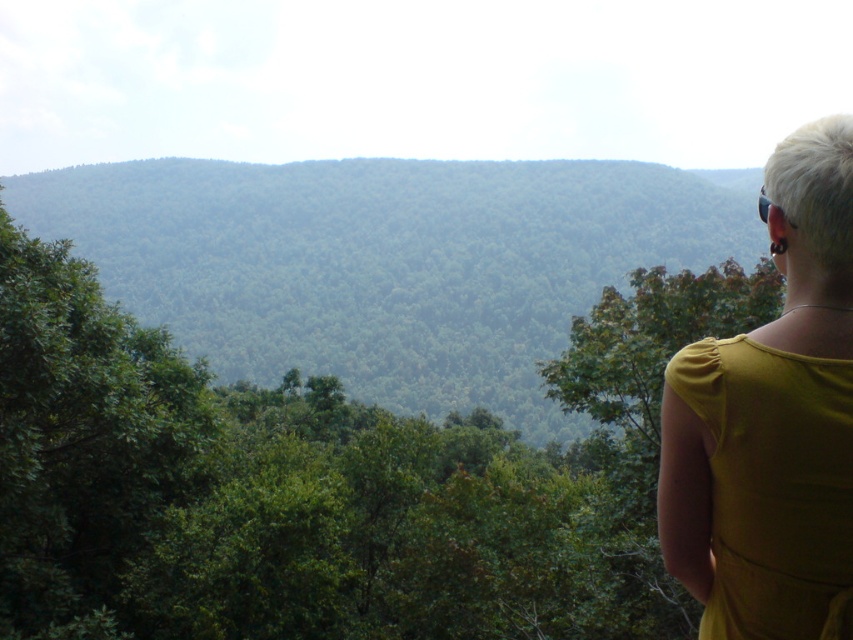
You are standing in the middle of the forest looking towards the hills. You notice a green leafy tree at upper right in your view. Can you estimate its position relative to the center of your field of view?

The green leafy tree at upper right is located at coordinates approximately 62.0 percent to the right and 41.1 percent up from the bottom left corner of the field of view.

You are standing in the middle of the forest scene and want to walk towards the two points marked in the image. Which point, point (x=756, y=548) or point (x=619, y=312), will you reach first?

You will reach point (x=756, y=548) first because it is closer to the camera than point (x=619, y=312).

Based on the photo, you are standing in the middle of the forest and see a green leafy tree at upper right and a green leafy tree at right. Which tree is closer to your left side?

The green leafy tree at upper right is positioned on the left side of green leafy tree at right, so it is closer to your left side.